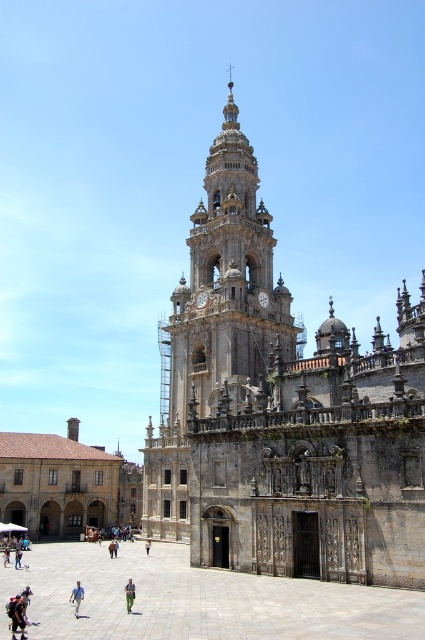
Question: Does dark gray backpack at lower left have a smaller size compared to blue fabric pants at lower left?

Choices:
 (A) no
 (B) yes

Answer: (B)

Question: Can you confirm if gray stone church at center is positioned above light brown leather jacket at center?

Choices:
 (A) no
 (B) yes

Answer: (B)

Question: Is green fabric pants at lower center wider than green fabric pants at center?

Choices:
 (A) no
 (B) yes

Answer: (A)

Question: Considering the real-world distances, which object is farthest from the blue fabric pants at lower left?

Choices:
 (A) green fabric pants at center
 (B) gray stone church at center
 (C) golden stone tower at center

Answer: (C)

Question: Which object appears farthest from the camera in this image?

Choices:
 (A) golden stone tower at center
 (B) light brown leather jacket at center
 (C) dark gray backpack at lower left
 (D) blue fabric pants at lower left

Answer: (A)

Question: Which point is closer to the camera taking this photo?

Choices:
 (A) tap(227, 122)
 (B) tap(16, 554)
 (C) tap(130, 611)

Answer: (C)